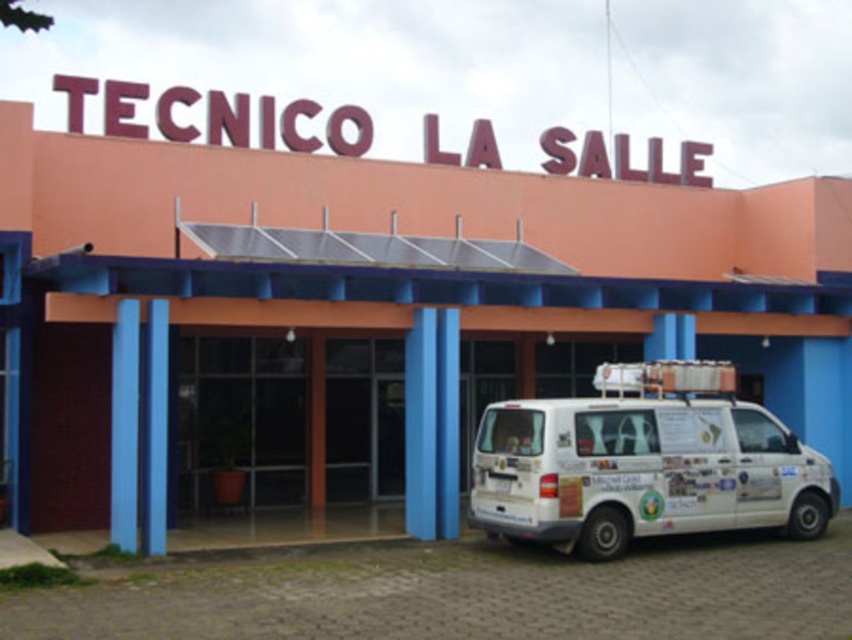
Question: Which point is farther from the camera taking this photo?

Choices:
 (A) (107, 272)
 (B) (764, 508)

Answer: (B)

Question: Is white van at center to the right of white matte van at lower right from the viewer's perspective?

Choices:
 (A) yes
 (B) no

Answer: (B)

Question: Where is white van at center located in relation to white matte van at lower right in the image?

Choices:
 (A) right
 (B) left

Answer: (B)

Question: Is white van at center thinner than white matte van at lower right?

Choices:
 (A) yes
 (B) no

Answer: (B)